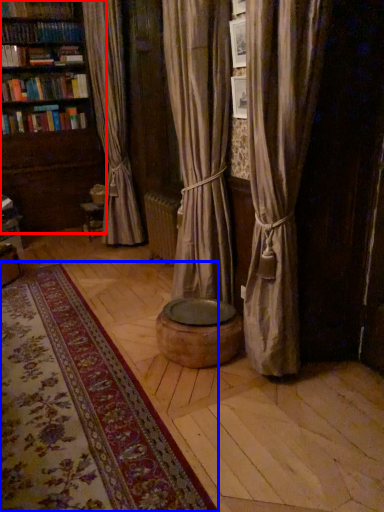
Question: Which of the following is the farthest to the observer, bookcase (highlighted by a red box) or mat (highlighted by a blue box)?

Choices:
 (A) bookcase
 (B) mat

Answer: (A)